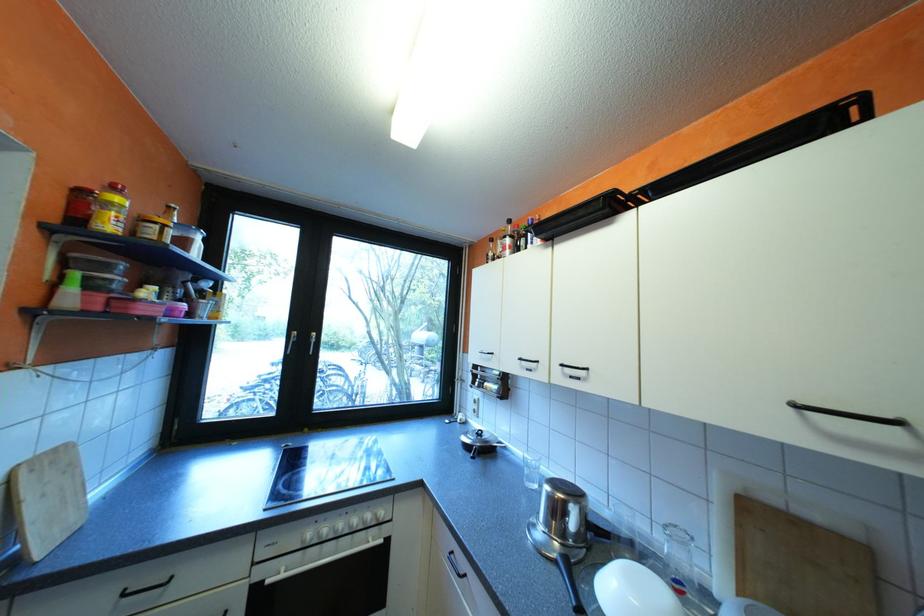
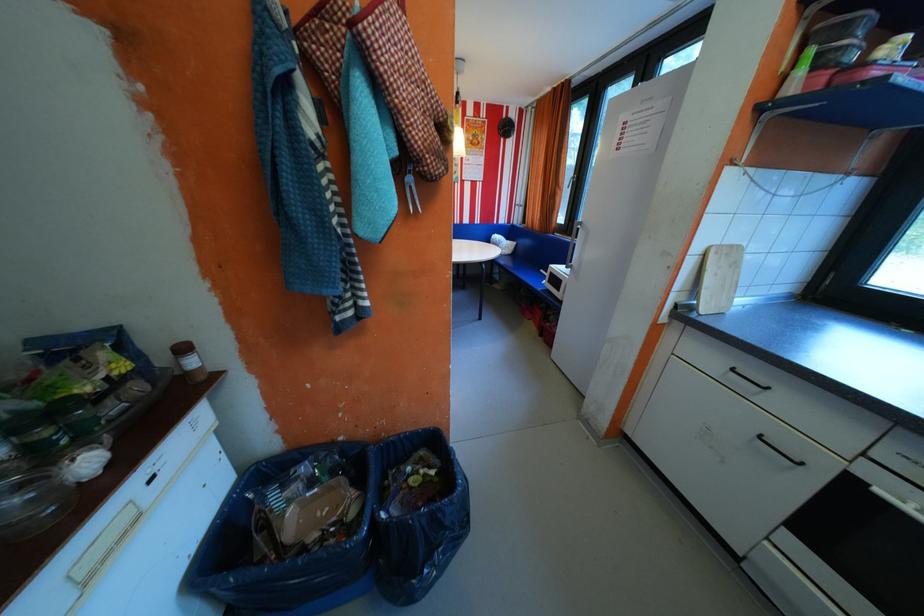
The images are taken continuously from a first-person perspective. In which direction is your viewpoint rotating?

The camera rotated toward left-down.